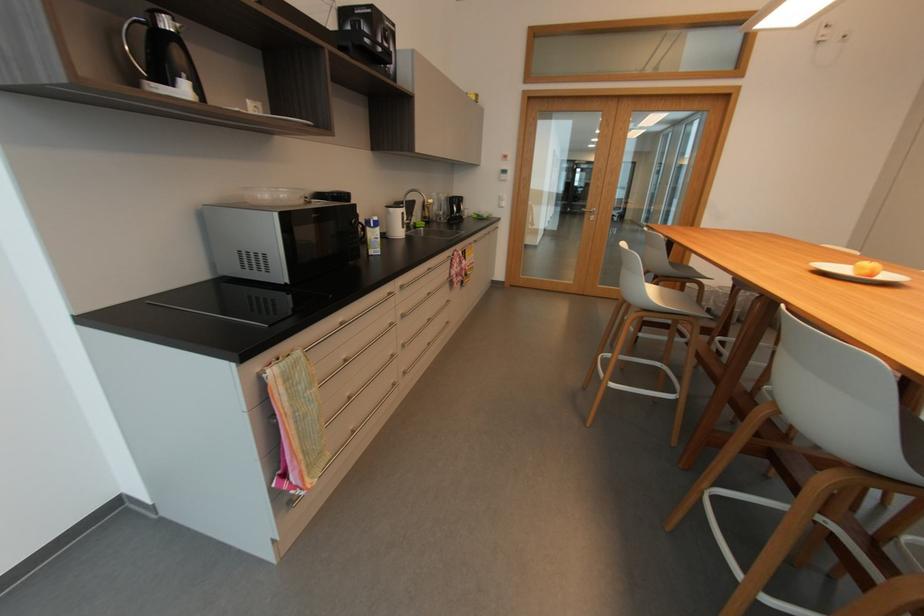
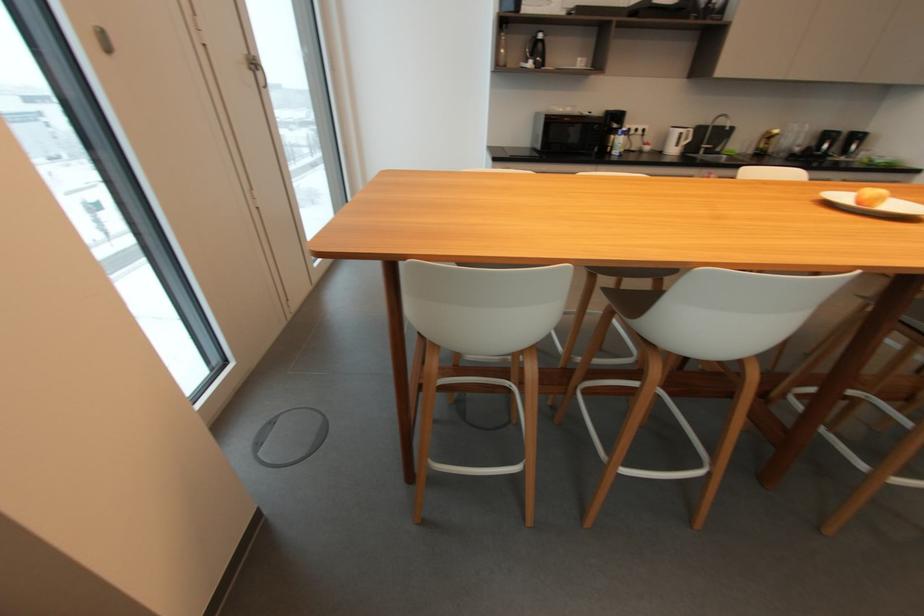
In the second image, find the point that corresponds to pixel 407 214 in the first image.

(685, 134)